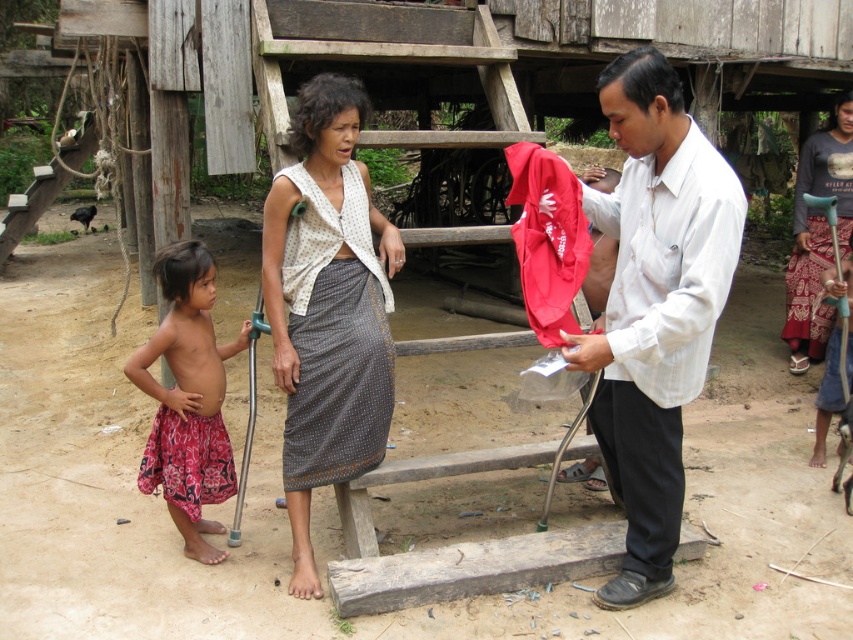
Question: Can you confirm if white linen shirt at center is smaller than patterned fabric skirt at center?

Choices:
 (A) yes
 (B) no

Answer: (B)

Question: Does patterned fabric skirt at left appear on the left side of gray dotted fabric skirt at center?

Choices:
 (A) no
 (B) yes

Answer: (B)

Question: Which object is positioned farthest from the patterned fabric skirt at center?

Choices:
 (A) patterned fabric skirt at left
 (B) gray printed skirt at center
 (C) white linen shirt at center
 (D) gray dotted fabric skirt at center

Answer: (B)

Question: Among these points, which one is nearest to the camera?

Choices:
 (A) pyautogui.click(x=167, y=333)
 (B) pyautogui.click(x=735, y=186)

Answer: (B)

Question: Which point appears closest to the camera in this image?

Choices:
 (A) (592, 413)
 (B) (160, 426)
 (C) (347, 289)
 (D) (822, 326)

Answer: (C)

Question: In this image, where is gray dotted fabric skirt at center located relative to gray printed skirt at center?

Choices:
 (A) right
 (B) left

Answer: (B)